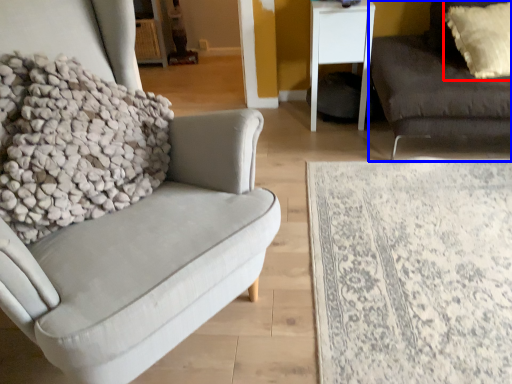
Question: Which object is closer to the camera taking this photo, pillow (highlighted by a red box) or studio couch (highlighted by a blue box)?

Choices:
 (A) pillow
 (B) studio couch

Answer: (B)